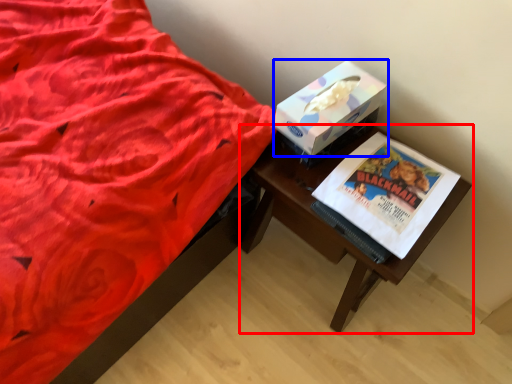
Question: Which object is closer to the camera taking this photo, table (highlighted by a red box) or box (highlighted by a blue box)?

Choices:
 (A) table
 (B) box

Answer: (A)